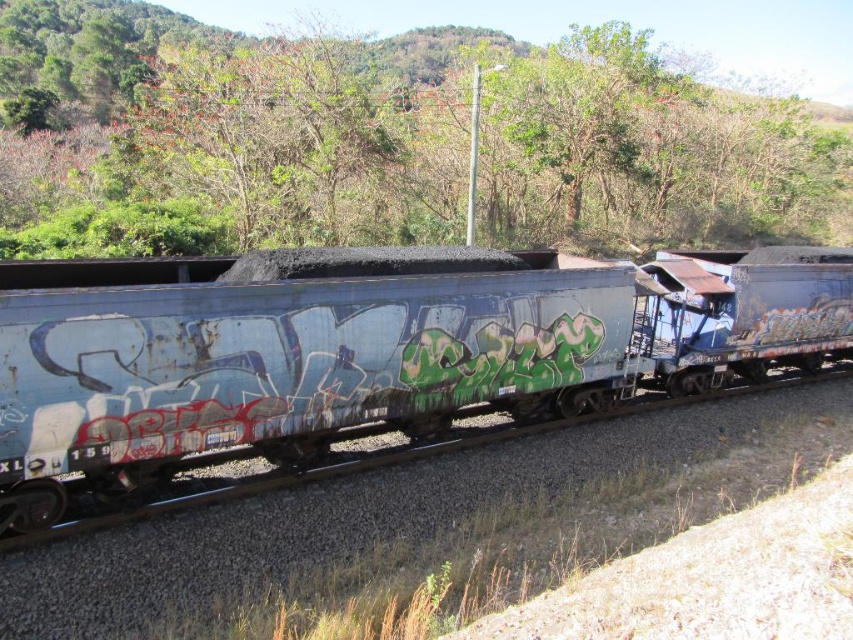
Does green leafy tree at upper center appear over rusty metal train car at center?

Correct, green leafy tree at upper center is located above rusty metal train car at center.

The height and width of the screenshot is (640, 853). Identify the location of green leafy tree at upper center. (393, 138).

You are a GUI agent. You are given a task and a screenshot of the screen. Output one action in this format:
    pyautogui.click(x=<x>, y=<y>)
    Task: Click on the green leafy tree at upper center
    The width and height of the screenshot is (853, 640).
    Given the screenshot: What is the action you would take?
    pyautogui.click(x=393, y=138)